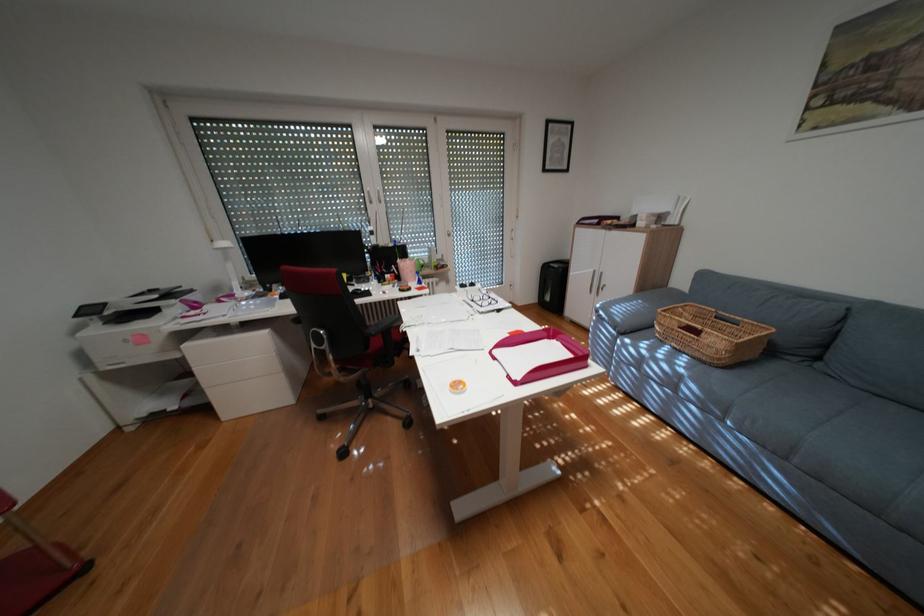
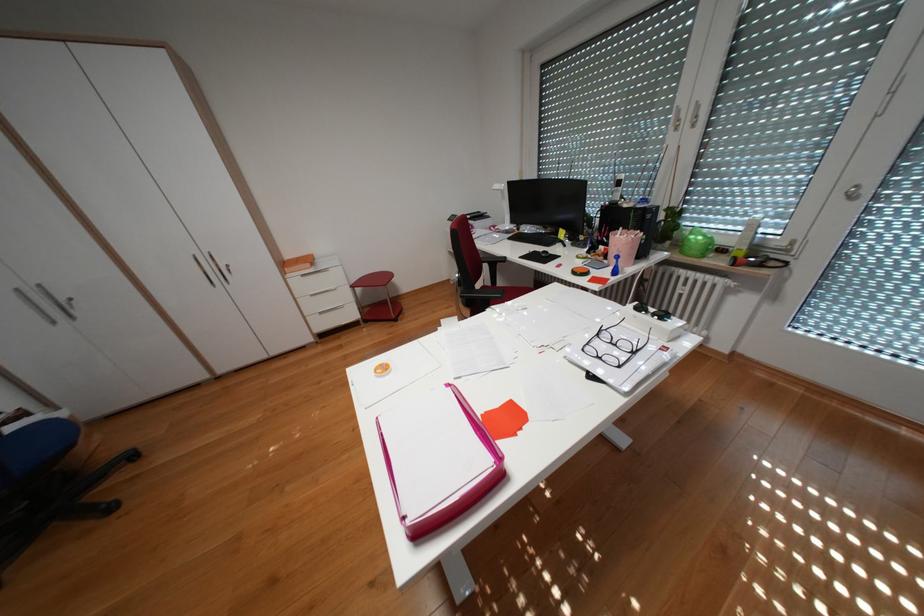
The point at (484,300) is marked in the first image. Where is the corresponding point in the second image?

(610, 334)